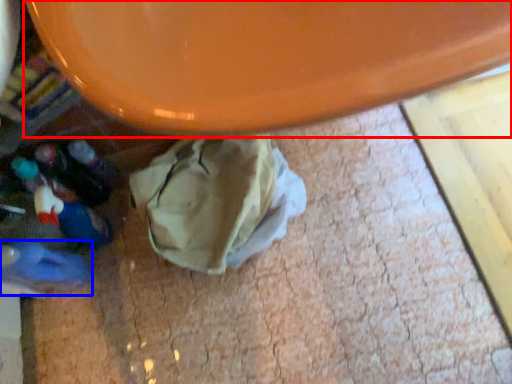
Question: Which of the following is the closest to the observer, round table (highlighted by a red box) or footwear (highlighted by a blue box)?

Choices:
 (A) round table
 (B) footwear

Answer: (A)